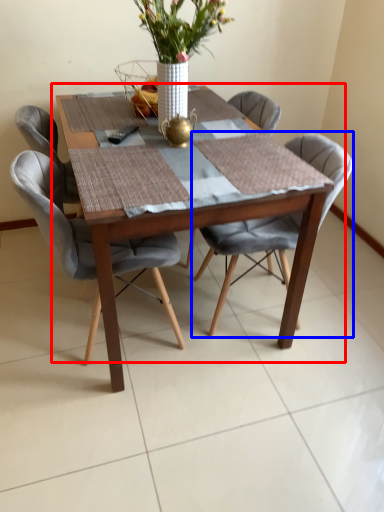
Question: Which object appears farthest to the camera in this image, kitchen & dining room table (highlighted by a red box) or chair (highlighted by a blue box)?

Choices:
 (A) kitchen & dining room table
 (B) chair

Answer: (B)